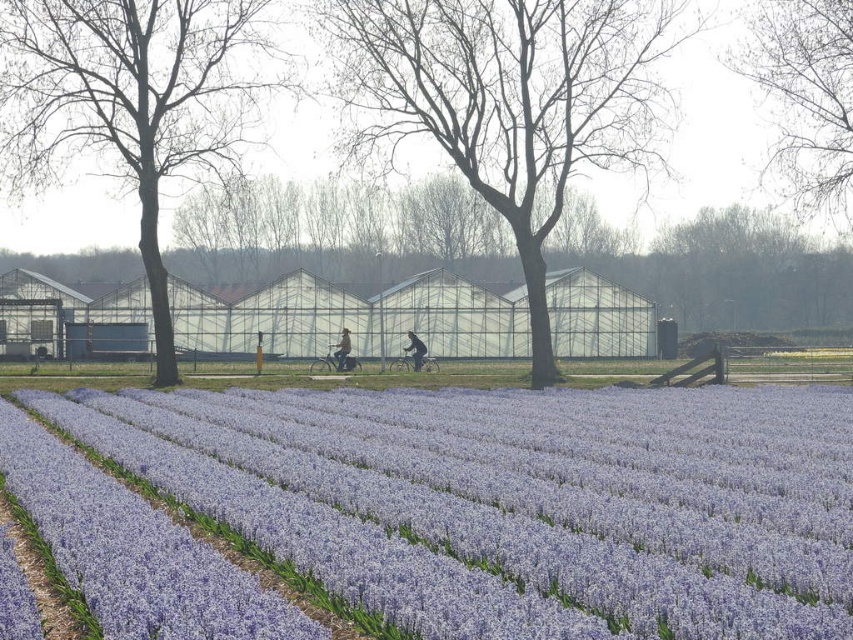
Question: Which point is farther to the camera?

Choices:
 (A) (419, 364)
 (B) (115, 17)

Answer: (A)

Question: Which of the following is the farthest from the observer?

Choices:
 (A) bare branches at center
 (B) bare wood tree at left

Answer: (A)

Question: Does bare branches at center appear under bare wood tree at left?

Choices:
 (A) yes
 (B) no

Answer: (B)

Question: Is purple matte flower at center positioned in front of bare branches at upper right?

Choices:
 (A) yes
 (B) no

Answer: (A)

Question: Which of the following is the closest to the observer?

Choices:
 (A) (250, 24)
 (B) (796, 129)
 (C) (421, 348)

Answer: (C)

Question: Is bare wood tree at left bigger than dark blue jeans at center?

Choices:
 (A) no
 (B) yes

Answer: (B)